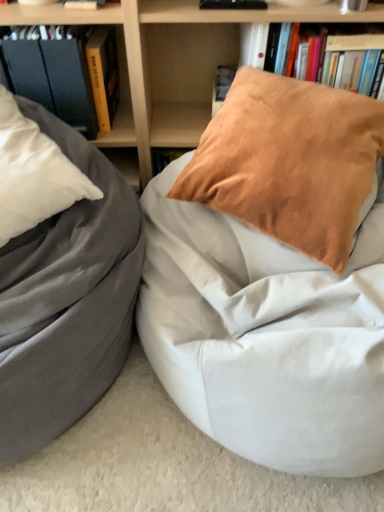
Question: Is hardcover book at upper center, placed as the 1th book when sorted from right to left, positioned behind white fabric bean bag at center?

Choices:
 (A) no
 (B) yes

Answer: (B)

Question: Is hardcover book at upper center, which ranks as the 3th book in left-to-right order, with white fabric bean bag at center?

Choices:
 (A) yes
 (B) no

Answer: (B)

Question: Would you say white fabric bean bag at center is part of hardcover book at upper center, which ranks as the 3th book in left-to-right order,'s contents?

Choices:
 (A) yes
 (B) no

Answer: (B)

Question: From a real-world perspective, is hardcover book at upper center, placed as the 1th book when sorted from right to left, positioned over white fabric bean bag at center based on gravity?

Choices:
 (A) no
 (B) yes

Answer: (B)

Question: From a real-world perspective, is hardcover book at upper center, placed as the 1th book when sorted from right to left, beneath white fabric bean bag at center?

Choices:
 (A) yes
 (B) no

Answer: (B)

Question: Is matte black book at upper left, placed as the third book when sorted from right to left, in front of or behind matte gray bean bag at left in the image?

Choices:
 (A) front
 (B) behind

Answer: (B)

Question: In terms of width, does matte black book at upper left, placed as the third book when sorted from right to left, look wider or thinner when compared to matte gray bean bag at left?

Choices:
 (A) thin
 (B) wide

Answer: (A)

Question: From a real-world perspective, is matte black book at upper left, acting as the 1th book starting from the left, above or below matte gray bean bag at left?

Choices:
 (A) below
 (B) above

Answer: (B)

Question: From their relative heights in the image, would you say matte black book at upper left, acting as the 1th book starting from the left, is taller or shorter than matte gray bean bag at left?

Choices:
 (A) short
 (B) tall

Answer: (A)

Question: Based on their sizes in the image, would you say white fabric bean bag at center is bigger or smaller than matte gray bean bag at left?

Choices:
 (A) small
 (B) big

Answer: (B)

Question: From a real-world perspective, is white fabric bean bag at center physically located above or below matte gray bean bag at left?

Choices:
 (A) above
 (B) below

Answer: (B)

Question: From the image's perspective, is white fabric bean bag at center located above or below matte gray bean bag at left?

Choices:
 (A) below
 (B) above

Answer: (A)

Question: Is point (182, 216) closer or farther from the camera than point (1, 332)?

Choices:
 (A) closer
 (B) farther

Answer: (B)

Question: In terms of height, does hardcover book at left look taller or shorter compared to matte gray bean bag at left?

Choices:
 (A) tall
 (B) short

Answer: (B)

Question: Is hardcover book at left spatially inside matte gray bean bag at left, or outside of it?

Choices:
 (A) inside
 (B) outside

Answer: (B)